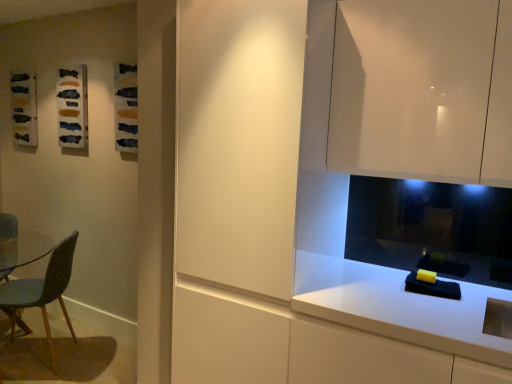
Question: Can you confirm if blue fabric chair at left is bigger than matte textured fabric at upper left?

Choices:
 (A) yes
 (B) no

Answer: (A)

Question: Would you say blue fabric chair at left is outside matte textured fabric at upper left?

Choices:
 (A) no
 (B) yes

Answer: (B)

Question: Does blue fabric chair at left appear on the right side of matte textured fabric at upper left?

Choices:
 (A) no
 (B) yes

Answer: (A)

Question: Is blue fabric chair at left taller than matte textured fabric at upper left?

Choices:
 (A) no
 (B) yes

Answer: (B)

Question: Considering the relative positions of blue fabric chair at left and matte textured fabric at upper left in the image provided, is blue fabric chair at left in front of matte textured fabric at upper left?

Choices:
 (A) yes
 (B) no

Answer: (A)

Question: Does blue fabric chair at left have a smaller size compared to matte textured fabric at upper left?

Choices:
 (A) yes
 (B) no

Answer: (B)

Question: Considering the relative sizes of matte white cabinet at center and matte textured fabric at upper left in the image provided, is matte white cabinet at center wider than matte textured fabric at upper left?

Choices:
 (A) no
 (B) yes

Answer: (B)

Question: From the image's perspective, is matte white cabinet at center under matte textured fabric at upper left?

Choices:
 (A) yes
 (B) no

Answer: (A)

Question: Can you confirm if matte white cabinet at center is positioned to the right of matte textured fabric at upper left?

Choices:
 (A) yes
 (B) no

Answer: (A)

Question: Considering the relative positions of matte white cabinet at center and matte textured fabric at upper left in the image provided, is matte white cabinet at center to the left of matte textured fabric at upper left from the viewer's perspective?

Choices:
 (A) yes
 (B) no

Answer: (B)

Question: Does matte white cabinet at center have a smaller size compared to matte textured fabric at upper left?

Choices:
 (A) no
 (B) yes

Answer: (A)

Question: Is matte white cabinet at center not inside matte textured fabric at upper left?

Choices:
 (A) yes
 (B) no

Answer: (A)

Question: Is blue fabric chair at left positioned with its back to white glossy countertop at lower right?

Choices:
 (A) yes
 (B) no

Answer: (B)